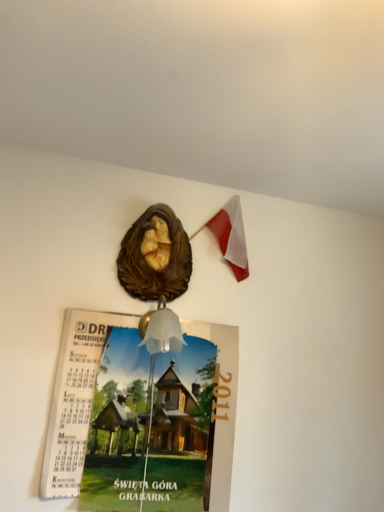
At what (x,y) coordinates should I click in order to perform the action: click on matte paper calendar at upper center. Please return your answer as a coordinate pair (x, y). This screenshot has height=512, width=384. Looking at the image, I should click on (141, 417).

In order to face translucent glass bell at center, should I rotate leftwards or rightwards?

Rotate left and turn 3.809 degrees.

Where is `translucent glass bell at center`? translucent glass bell at center is located at coordinates (163, 331).

Find the location of a particular element. The width and height of the screenshot is (384, 512). matte paper calendar at upper center is located at coordinates (141, 417).

From a real-world perspective, relative to translucent glass bell at center, is white fabric flag at upper right vertically above or below?

white fabric flag at upper right is above translucent glass bell at center.

Is translucent glass bell at center at the back of white fabric flag at upper right?

No, translucent glass bell at center is not at the back of white fabric flag at upper right.

Is white fabric flag at upper right not close to translucent glass bell at center?

white fabric flag at upper right is actually quite close to translucent glass bell at center.

From the image's perspective, is white fabric flag at upper right located above or below translucent glass bell at center?

From the image's perspective, white fabric flag at upper right appears above translucent glass bell at center.

From the image's perspective, does translucent glass bell at center appear higher than white fabric flag at upper right?

No, from the image's perspective, translucent glass bell at center is not over white fabric flag at upper right.

What's the angular difference between translucent glass bell at center and white fabric flag at upper right's facing directions?

The angular difference between translucent glass bell at center and white fabric flag at upper right is 0.374 degrees.

Can you confirm if translucent glass bell at center is positioned to the right of white fabric flag at upper right?

No, translucent glass bell at center is not to the right of white fabric flag at upper right.

Which of these two, matte paper calendar at upper center or white fabric flag at upper right, stands taller?

With more height is matte paper calendar at upper center.

You are a GUI agent. You are given a task and a screenshot of the screen. Output one action in this format:
    pyautogui.click(x=<x>, y=<y>)
    Task: Click on the flag on the right of matte paper calendar at upper center
    The width and height of the screenshot is (384, 512).
    Given the screenshot: What is the action you would take?
    pyautogui.click(x=231, y=236)

Is matte paper calendar at upper center positioned with its back to white fabric flag at upper right?

No, matte paper calendar at upper center's orientation is not away from white fabric flag at upper right.

Is white fabric flag at upper right aimed at matte paper calendar at upper center?

No, white fabric flag at upper right is not facing towards matte paper calendar at upper center.

Which of these two, white fabric flag at upper right or matte paper calendar at upper center, is bigger?

matte paper calendar at upper center.

In the scene shown: From the image's perspective, which object appears higher, white fabric flag at upper right or matte paper calendar at upper center?

white fabric flag at upper right is shown above in the image.

Considering the sizes of matte paper calendar at upper center and translucent glass bell at center in the image, is matte paper calendar at upper center wider or thinner than translucent glass bell at center?

Clearly, matte paper calendar at upper center has less width compared to translucent glass bell at center.

Looking at this image, is matte paper calendar at upper center at the left side of translucent glass bell at center?

Indeed, matte paper calendar at upper center is positioned on the left side of translucent glass bell at center.

Can you tell me how much matte paper calendar at upper center and translucent glass bell at center differ in facing direction?

matte paper calendar at upper center and translucent glass bell at center are facing 0.133 degrees away from each other.

Considering their positions, is matte paper calendar at upper center located in front of or behind translucent glass bell at center?

Visually, matte paper calendar at upper center is located behind translucent glass bell at center.

From the image's perspective, which one is positioned lower, translucent glass bell at center or matte paper calendar at upper center?

matte paper calendar at upper center is shown below in the image.

Does translucent glass bell at center turn towards matte paper calendar at upper center?

No, translucent glass bell at center is not turned towards matte paper calendar at upper center.

How distant is translucent glass bell at center from matte paper calendar at upper center?

They are 10.83 inches apart.

Can you confirm if translucent glass bell at center is positioned to the left of matte paper calendar at upper center?

Incorrect, translucent glass bell at center is not on the left side of matte paper calendar at upper center.

This screenshot has width=384, height=512. Identify the location of flag that appears above the translucent glass bell at center (from the image's perspective). point(231,236).

Find the location of `flag above the translucent glass bell at center (from a real-world perspective)`. flag above the translucent glass bell at center (from a real-world perspective) is located at coordinates (231, 236).

Considering their positions, is translucent glass bell at center positioned closer to white fabric flag at upper right than matte paper calendar at upper center?

translucent glass bell at center lies closer to white fabric flag at upper right than the other object.

Based on their spatial positions, is translucent glass bell at center or white fabric flag at upper right further from matte paper calendar at upper center?

Among the two, white fabric flag at upper right is located further to matte paper calendar at upper center.

When comparing their distances from matte paper calendar at upper center, does white fabric flag at upper right or translucent glass bell at center seem further?

The object further to matte paper calendar at upper center is white fabric flag at upper right.

When comparing their distances from white fabric flag at upper right, does matte paper calendar at upper center or translucent glass bell at center seem closer?

translucent glass bell at center.

From the picture: Which object lies further to the anchor point translucent glass bell at center, matte paper calendar at upper center or white fabric flag at upper right?

Based on the image, white fabric flag at upper right appears to be further to translucent glass bell at center.

Based on their spatial positions, is white fabric flag at upper right or matte paper calendar at upper center closer to translucent glass bell at center?

Among the two, matte paper calendar at upper center is located nearer to translucent glass bell at center.

This screenshot has width=384, height=512. Find the location of `lamp between white fabric flag at upper right and matte paper calendar at upper center in the up-down direction`. lamp between white fabric flag at upper right and matte paper calendar at upper center in the up-down direction is located at coordinates (163, 331).